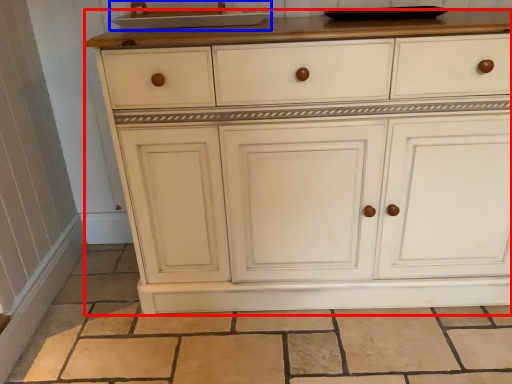
Question: Which point is closer to the camera, chest of drawers (highlighted by a red box) or sink (highlighted by a blue box)?

Choices:
 (A) chest of drawers
 (B) sink

Answer: (A)